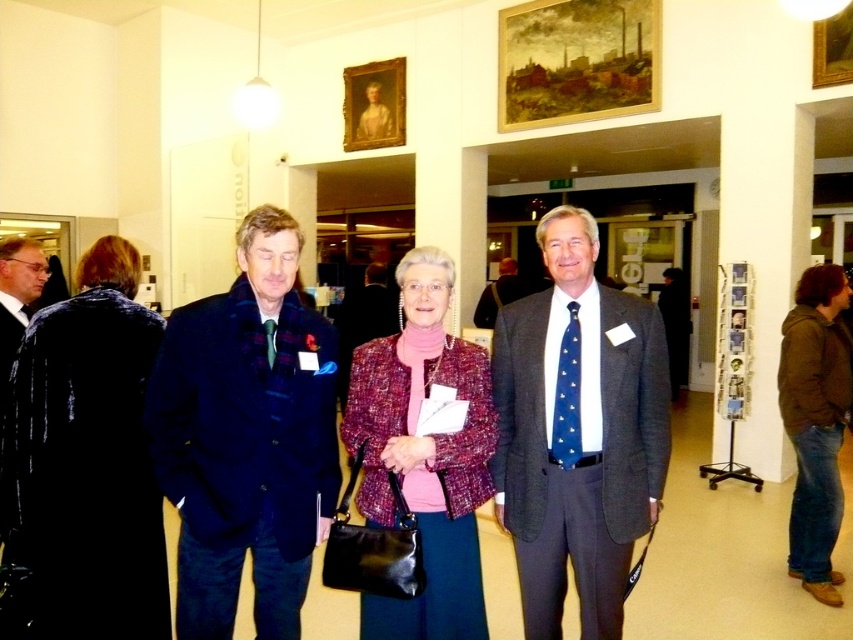
Question: Which object is closer to the camera taking this photo?

Choices:
 (A) dark blue wool coat at center
 (B) denim jacket at lower right
 (C) matte black suit at left

Answer: (A)

Question: Does velvet black coat at left have a smaller size compared to denim jacket at lower right?

Choices:
 (A) yes
 (B) no

Answer: (A)

Question: In this image, where is velvet black coat at left located relative to matte black suit at left?

Choices:
 (A) above
 (B) below

Answer: (B)

Question: Which point is closer to the camera taking this photo?

Choices:
 (A) (804, 417)
 (B) (590, 348)
 (C) (148, 444)
 (D) (474, 508)

Answer: (C)

Question: Based on their relative distances, which object is farther from the matte black suit at left?

Choices:
 (A) plaid wool jacket at center
 (B) dark gray suit at center
 (C) dark blue wool coat at center

Answer: (B)

Question: Is dark blue wool coat at center to the right of dark gray suit at center from the viewer's perspective?

Choices:
 (A) no
 (B) yes

Answer: (A)